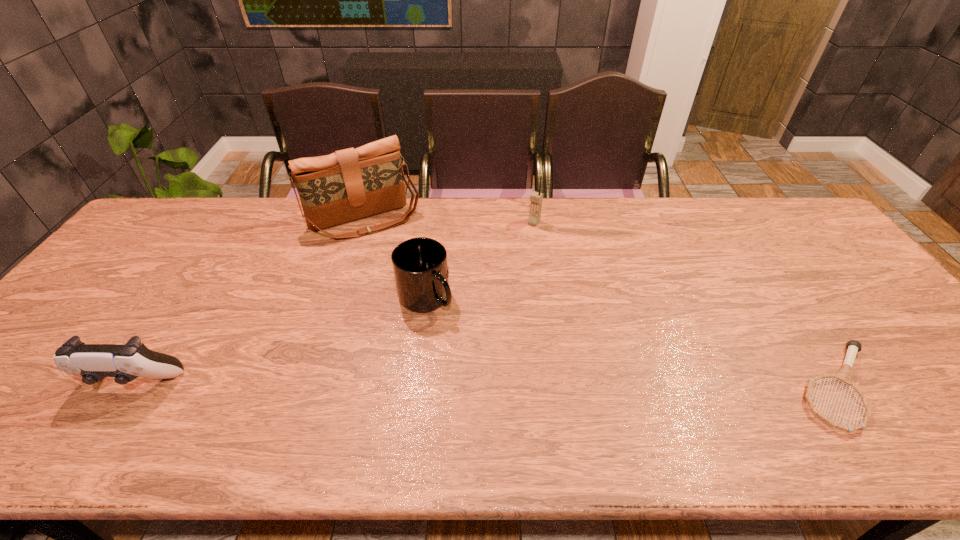
Find the location of `vacant space in between the rightmost object and the leftmost object`. vacant space in between the rightmost object and the leftmost object is located at coordinates (486, 385).

This screenshot has height=540, width=960. Find the location of `unoccupied area between the shortest object and the control`. unoccupied area between the shortest object and the control is located at coordinates (486, 385).

At what (x,y) coordinates should I click in order to perform the action: click on free space between the leftmost object and the third nearest object. Please return your answer as a coordinate pair (x, y). The height and width of the screenshot is (540, 960). Looking at the image, I should click on (279, 340).

The image size is (960, 540). What are the coordinates of `empty location between the rightmost object and the tallest object` in the screenshot? It's located at (602, 303).

Locate an element on the screen. The image size is (960, 540). free space that is in between the mug and the control is located at coordinates (279, 340).

The height and width of the screenshot is (540, 960). Identify the location of vacant space that's between the shortest object and the mug. (633, 342).

This screenshot has width=960, height=540. In order to click on empty space that is in between the control and the tallest object in this screenshot , I will do `click(250, 301)`.

Select which object appears as the closest to the second tallest object. Please provide its 2D coordinates. Your answer should be formatted as a tuple, i.e. [(x, y)], where the tuple contains the x and y coordinates of a point satisfying the conditions above.

[(420, 267)]

Locate an element on the screen. The height and width of the screenshot is (540, 960). object that is the second closest to the tallest object is located at coordinates (536, 198).

Find the location of a particular element. vacant space that satisfies the following two spatial constraints: 1. on the front-facing side of the control; 2. on the left side of the tennis racket is located at coordinates (131, 387).